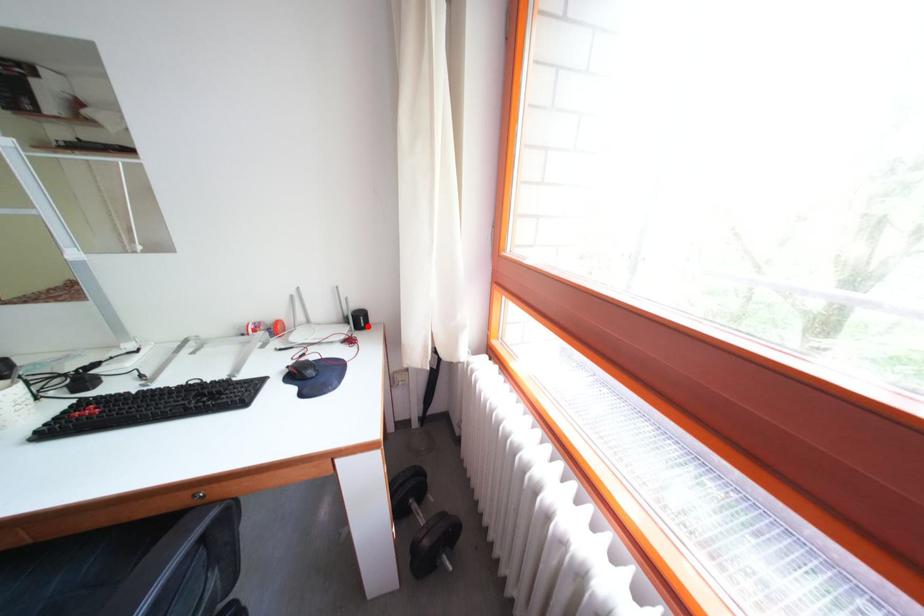
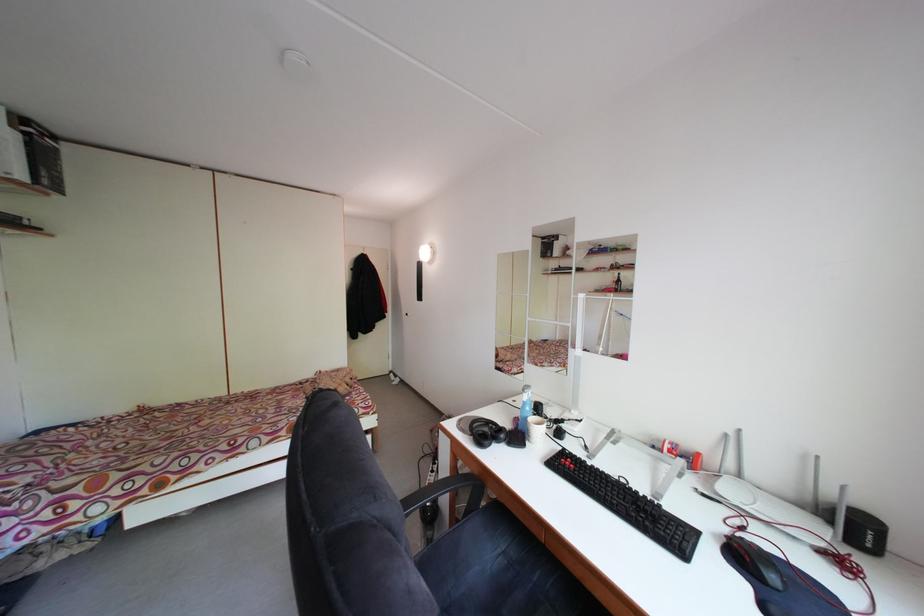
Locate, in the second image, the point that corresponds to the highlighted location in the first image.

(865, 535)